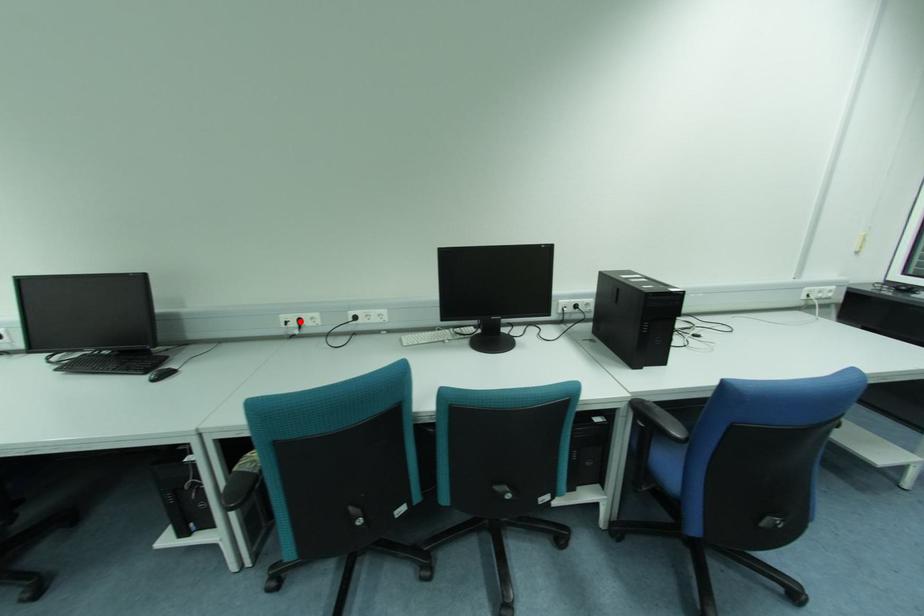
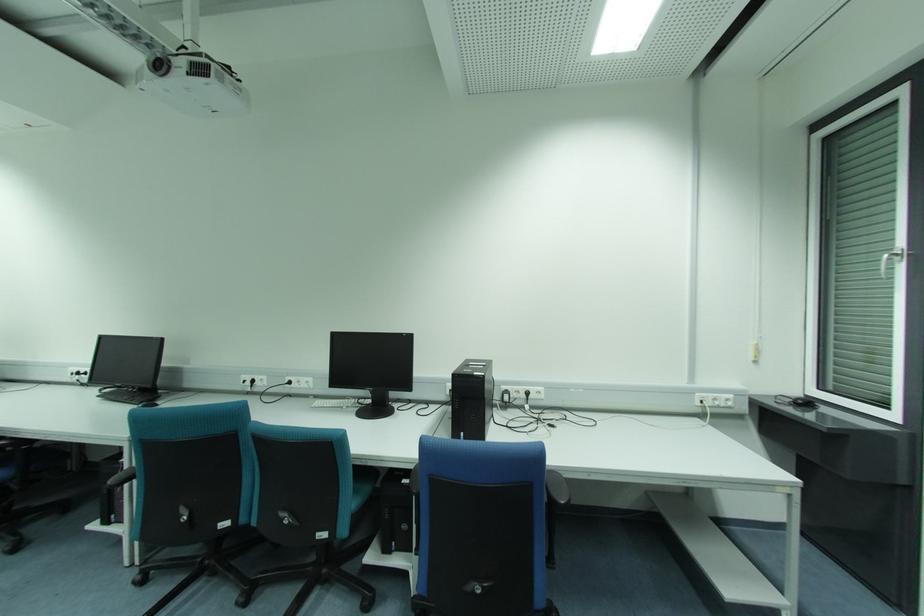
Where in the second image is the point corresponding to the highlighted location from the first image?

(253, 381)